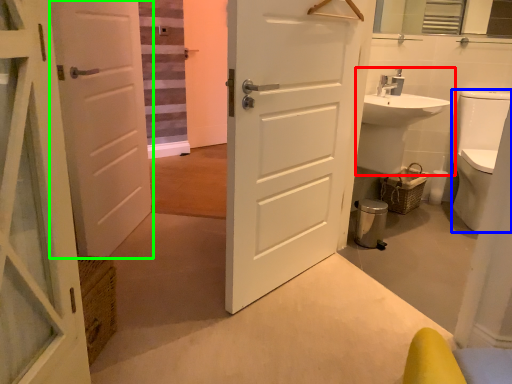
Question: Which object is positioned closest to sink (highlighted by a red box)? Select from toilet bowl (highlighted by a blue box) and door (highlighted by a green box).

Choices:
 (A) toilet bowl
 (B) door

Answer: (A)